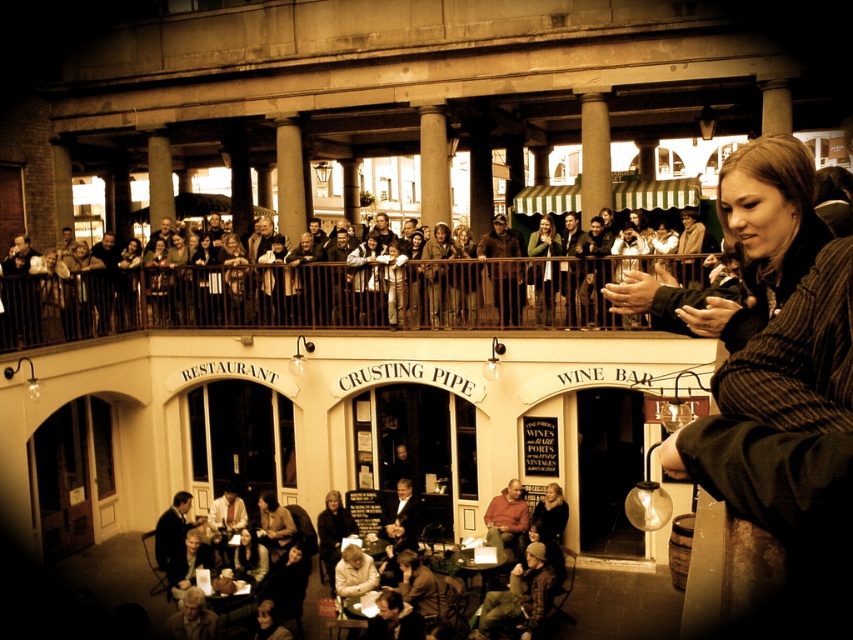
You are a photographer trying to capture a clear shot of the two jackets, the brown leather jacket at upper center and the green fabric jacket at upper center, from the ground level. Which jacket will appear smaller in your photo?

The brown leather jacket at upper center is shorter than the green fabric jacket at upper center, so it will appear smaller in the photo.

You are a photographer standing at the bottom of the balcony looking up. You see two jackets at the upper center of the balcony. Which jacket is closer to you, the brown leather jacket at upper center or the green fabric jacket at upper center?

The brown leather jacket at upper center is closer to you because it is located below the green fabric jacket at upper center.

You are standing on the balcony of the Crusting Pipe restaurant and want to take a photo of both the brown leather jacket at upper center and the green fabric jacket at upper center. Which jacket should you position to the left side of your camera frame to include both in the photo?

To include both the brown leather jacket at upper center and the green fabric jacket at upper center in your photo, position the brown leather jacket at upper center to the left side of your camera frame since it is already located to the left of the green fabric jacket at upper center.